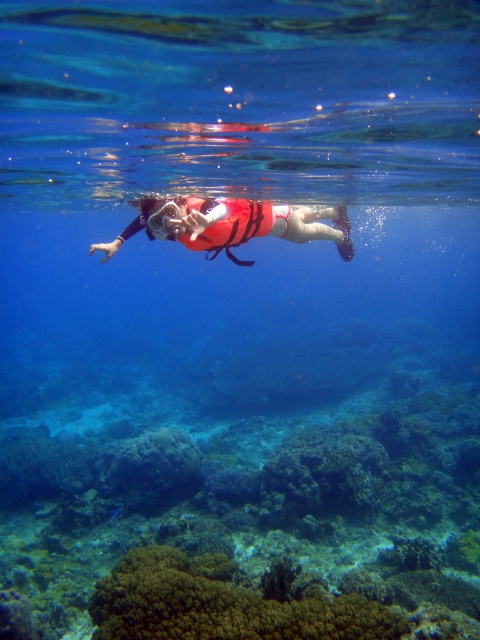
Describe the element at coordinates (250, 525) in the screenshot. I see `green textured coral reef at center` at that location.

Is green textured coral reef at center positioned before brown textured coral at lower center?

No, green textured coral reef at center is behind brown textured coral at lower center.

The image size is (480, 640). Identify the location of green textured coral reef at center. (250, 525).

Measure the distance from brown textured coral at lower center to red life vest at center.

brown textured coral at lower center and red life vest at center are 4.46 meters apart.

Who is more distant from viewer, (245, 602) or (237, 198)?

The point (237, 198) is behind.

Identify the location of brown textured coral at lower center. The image size is (480, 640). (220, 604).

Where is `brown textured coral at lower center`? brown textured coral at lower center is located at coordinates (220, 604).

Is point (239, 632) less distant than point (264, 225)?

That is True.

This screenshot has height=640, width=480. What do you see at coordinates (250, 525) in the screenshot? I see `green textured coral reef at center` at bounding box center [250, 525].

The width and height of the screenshot is (480, 640). Find the location of `green textured coral reef at center`. green textured coral reef at center is located at coordinates (250, 525).